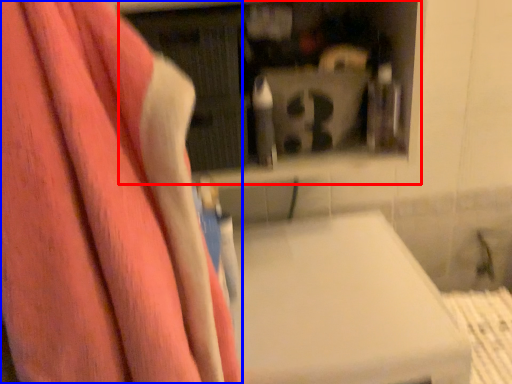
Question: Which point is further to the camera, shelf (highlighted by a red box) or towel (highlighted by a blue box)?

Choices:
 (A) shelf
 (B) towel

Answer: (A)